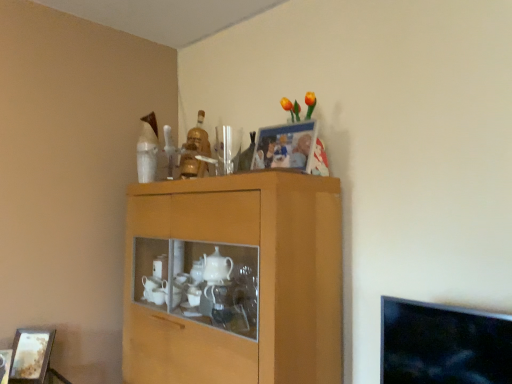
Question: From the image's perspective, is wooden picture frame at lower left, the 1th picture frame viewed from the left, located above or below matte plastic picture frame at upper center, the 1th picture frame positioned from the right?

Choices:
 (A) below
 (B) above

Answer: (A)

Question: Is point (29, 377) closer or farther from the camera than point (268, 162)?

Choices:
 (A) closer
 (B) farther

Answer: (B)

Question: Which object is the closest to the wooden cabinet at center?

Choices:
 (A) matte plastic picture frame at upper center, the first picture frame viewed from the top
 (B) wooden picture frame at lower left, arranged as the second picture frame when viewed from the top

Answer: (A)

Question: Which is farther from the wooden picture frame at lower left, arranged as the second picture frame when viewed from the top?

Choices:
 (A) wooden cabinet at center
 (B) matte plastic picture frame at upper center, the 1th picture frame positioned from the right

Answer: (B)